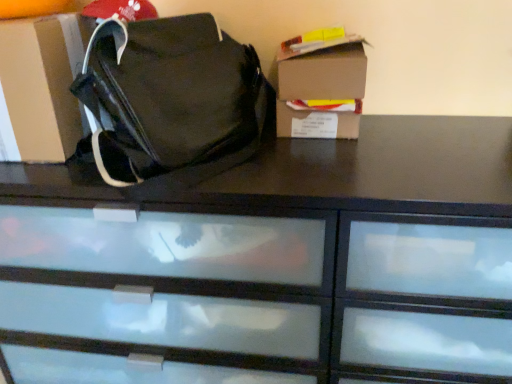
Locate an element on the screen. free spot in front of cardboard box at upper right is located at coordinates (322, 159).